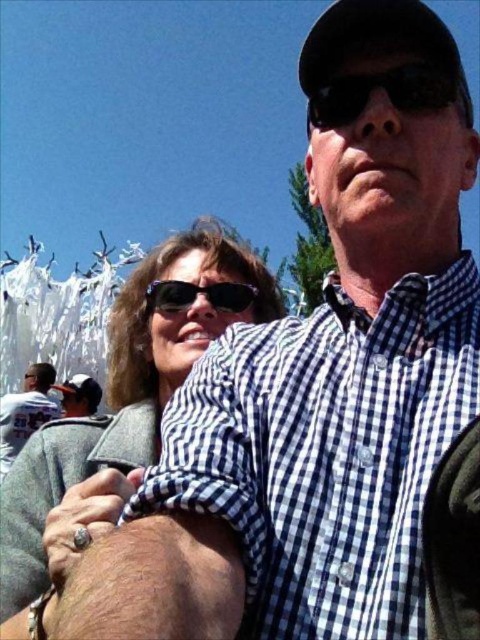
Question: Is checkered fabric shirt at center bigger than white jersey at left?

Choices:
 (A) no
 (B) yes

Answer: (B)

Question: Is checkered fabric shirt at center wider than white jersey at left?

Choices:
 (A) no
 (B) yes

Answer: (B)

Question: Where is checkered fabric shirt at center located in relation to matte black cap at upper left in the image?

Choices:
 (A) above
 (B) below

Answer: (A)

Question: Which point is closer to the camera?

Choices:
 (A) (70, 406)
 (B) (238, 256)
 (C) (216, 308)

Answer: (C)

Question: Which point is closer to the camera?

Choices:
 (A) black reflective sunglasses at upper center
 (B) black reflective sunglasses at center

Answer: (A)

Question: Estimate the real-world distances between objects in this image. Which object is closer to the checkered fabric shirt at center?

Choices:
 (A) matte black cap at upper left
 (B) black reflective sunglasses at center
 (C) black reflective sunglasses at upper center

Answer: (B)